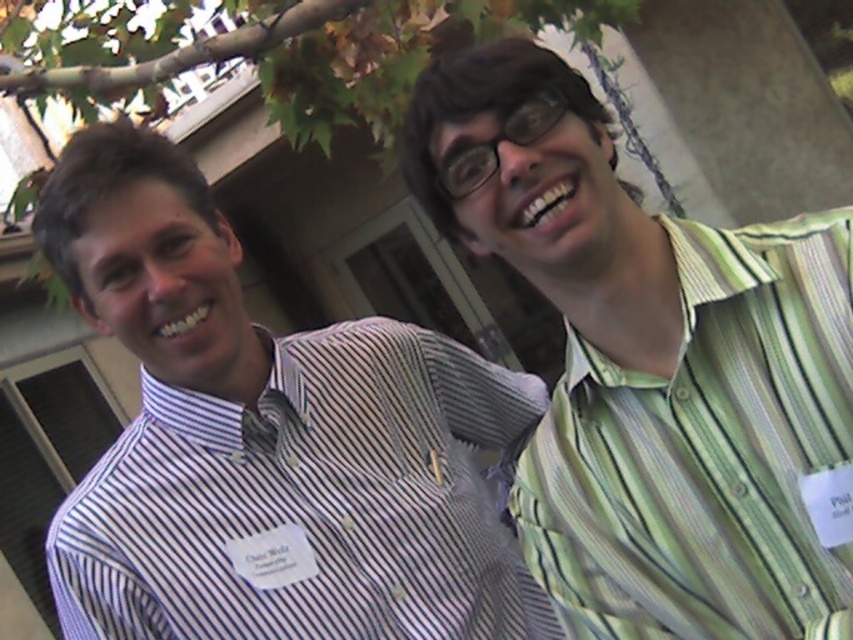
Looking at this image, does green striped shirt at right appear on the left side of white striped shirt at left?

No, green striped shirt at right is not to the left of white striped shirt at left.

Is green striped shirt at right to the right of white striped shirt at left from the viewer's perspective?

Yes, green striped shirt at right is to the right of white striped shirt at left.

Between point (817, 496) and point (114, 493), which one is positioned behind?

The point (114, 493) is more distant.

The height and width of the screenshot is (640, 853). Find the location of `green striped shirt at right`. green striped shirt at right is located at coordinates (654, 369).